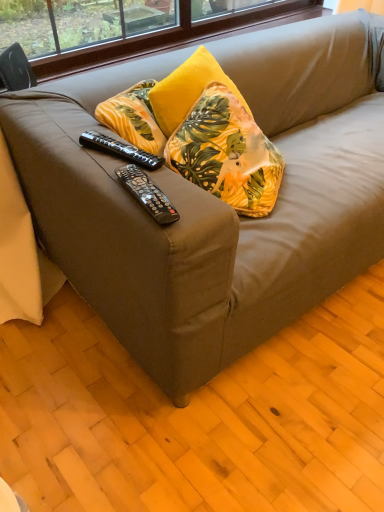
Where is `vacant space behind black plastic remote control at center, the 1th remote control positioned from the back`? vacant space behind black plastic remote control at center, the 1th remote control positioned from the back is located at coordinates (115, 116).